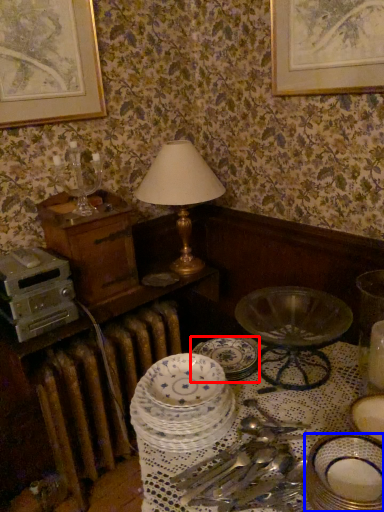
Question: Among these objects, which one is farthest to the camera, plate (highlighted by a red box) or plate (highlighted by a blue box)?

Choices:
 (A) plate
 (B) plate

Answer: (A)